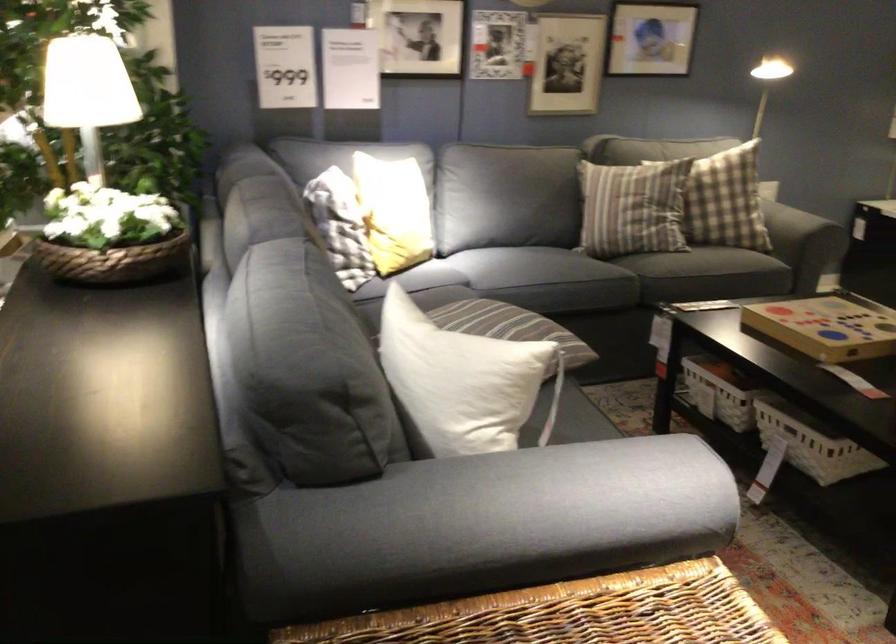
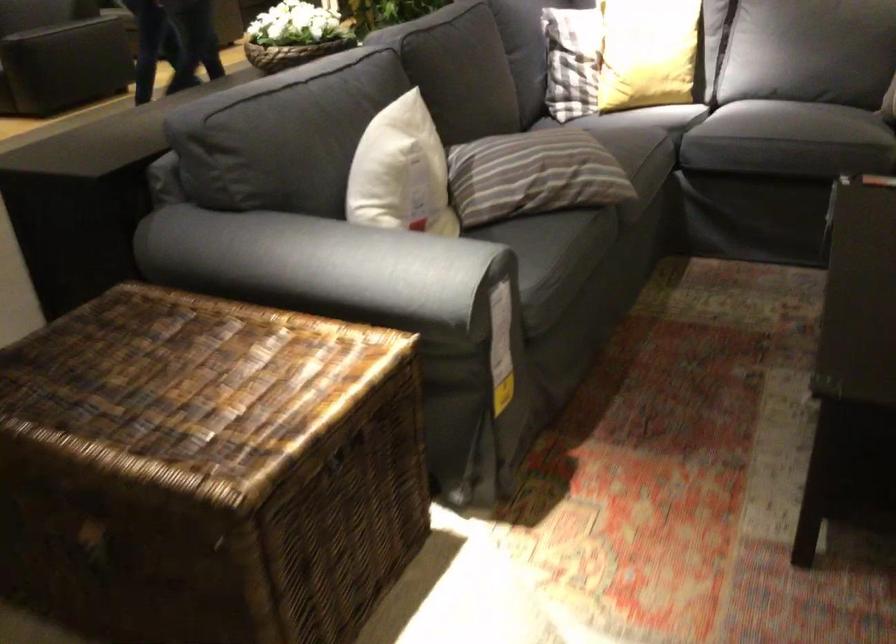
Locate, in the second image, the point that corresponds to point (493, 360) in the first image.

(401, 172)